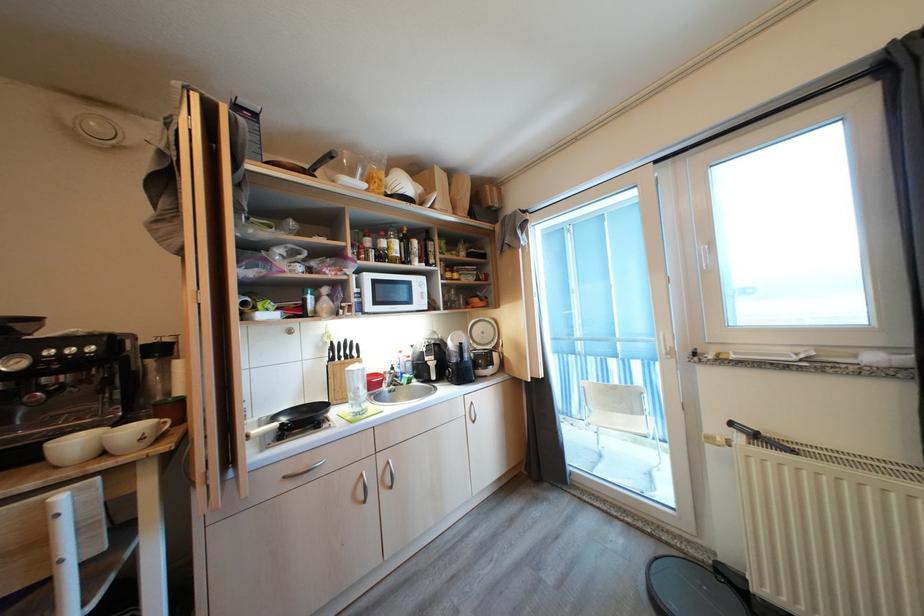
This screenshot has height=616, width=924. Describe the element at coordinates (667, 344) in the screenshot. I see `a white door handle` at that location.